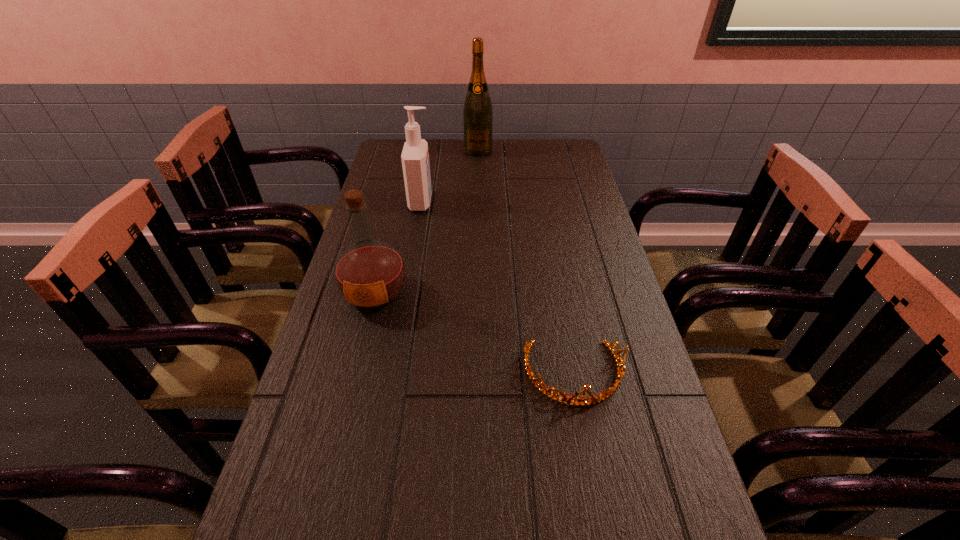
Find the location of a particular element. The height and width of the screenshot is (540, 960). the second object from right to left is located at coordinates (477, 113).

At what (x,y) coordinates should I click in order to perform the action: click on the farthest object. Please return your answer as a coordinate pair (x, y). The image size is (960, 540). Looking at the image, I should click on (477, 113).

The image size is (960, 540). I want to click on cleansing agent, so (x=415, y=157).

Locate an element on the screen. the third farthest object is located at coordinates (370, 274).

Locate an element on the screen. the shortest object is located at coordinates (605, 394).

Identify the location of the rightmost object. (605, 394).

Find the location of a particular element. The width and height of the screenshot is (960, 540). vacant space located on the front-facing side of the wine bottle is located at coordinates (478, 180).

Locate an element on the screen. free space located 0.070m on the front label of the third nearest object is located at coordinates (455, 202).

Where is `vacant space located 0.100m on the front label of the liquor`? Image resolution: width=960 pixels, height=540 pixels. vacant space located 0.100m on the front label of the liquor is located at coordinates (361, 352).

Where is `free region located 0.170m on the front-facing side of the tiara`? Image resolution: width=960 pixels, height=540 pixels. free region located 0.170m on the front-facing side of the tiara is located at coordinates (597, 501).